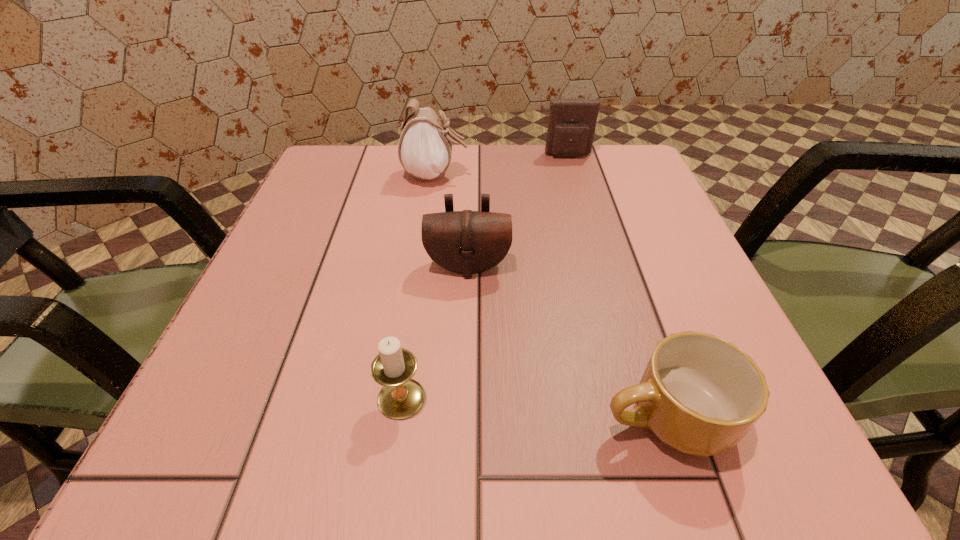
Find the location of a particular element. This screenshot has height=540, width=960. the tallest object is located at coordinates (425, 147).

Where is `the tallest pouch`? the tallest pouch is located at coordinates [x=425, y=147].

In order to click on the rightmost pouch in this screenshot , I will do `click(572, 121)`.

Where is `the farthest pouch`? The width and height of the screenshot is (960, 540). the farthest pouch is located at coordinates (572, 121).

What are the coordinates of `the third farthest object` in the screenshot? It's located at (467, 242).

What are the coordinates of `candle holder` in the screenshot? It's located at (400, 397).

Where is `the shortest object`? The image size is (960, 540). the shortest object is located at coordinates (699, 394).

Find the location of a particular element. The height and width of the screenshot is (540, 960). vacant region located 0.190m on the front-facing side of the tallest object is located at coordinates (556, 175).

You are a GUI agent. You are given a task and a screenshot of the screen. Output one action in this format:
    pyautogui.click(x=<x>, y=<y>)
    Task: Click on the vacant space located 0.080m with an open flap on the farthest pouch
    Image resolution: width=960 pixels, height=540 pixels.
    Given the screenshot: What is the action you would take?
    click(x=575, y=179)

Find the location of `vacant space located 0.060m with the flap open on the third farthest object`. vacant space located 0.060m with the flap open on the third farthest object is located at coordinates (467, 308).